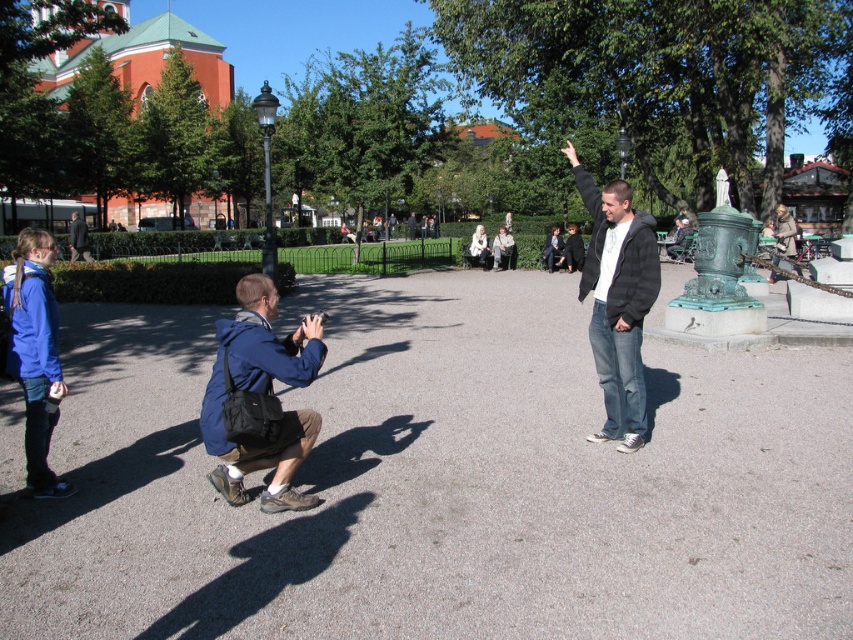
Question: Is blue fabric jacket at lower left to the left of dark blue jacket at center from the viewer's perspective?

Choices:
 (A) yes
 (B) no

Answer: (B)

Question: Which object is the farthest from the blue fabric jacket at lower left?

Choices:
 (A) blue denim jacket at lower left
 (B) dark blue jacket at center

Answer: (B)

Question: Considering the relative positions of blue fabric jacket at lower left and black hoodie at center in the image provided, where is blue fabric jacket at lower left located with respect to black hoodie at center?

Choices:
 (A) right
 (B) left

Answer: (B)

Question: Which of the following is the farthest from the observer?

Choices:
 (A) blue fabric jacket at lower left
 (B) blue denim jacket at lower left
 (C) black hoodie at center
 (D) dark blue jacket at center

Answer: (D)

Question: Among these objects, which one is nearest to the camera?

Choices:
 (A) blue denim jacket at lower left
 (B) blue fabric jacket at lower left
 (C) black hoodie at center

Answer: (B)

Question: Does blue fabric jacket at lower left have a smaller size compared to dark blue jacket at center?

Choices:
 (A) yes
 (B) no

Answer: (A)